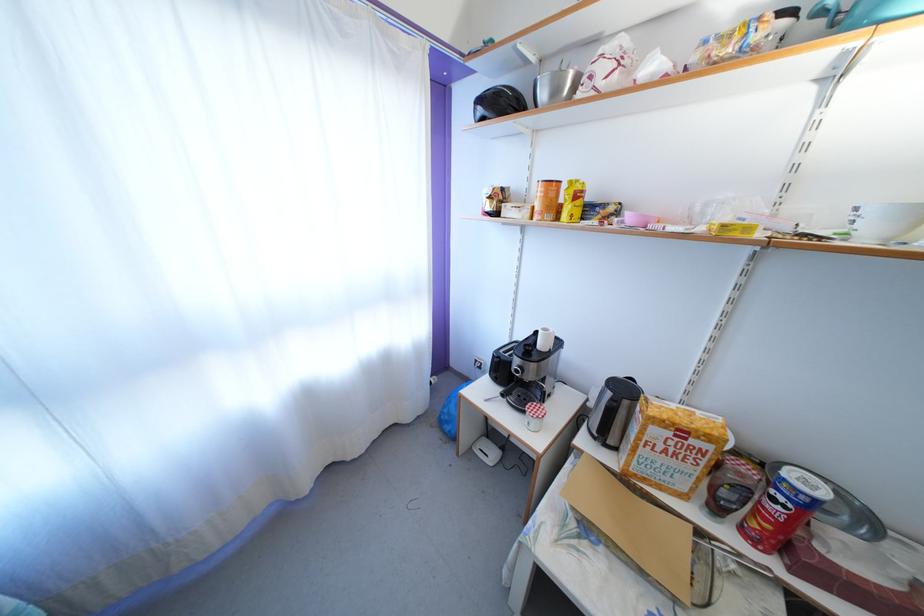
The location [544,339] corresponds to which object?

It refers to a white ceramic cup.